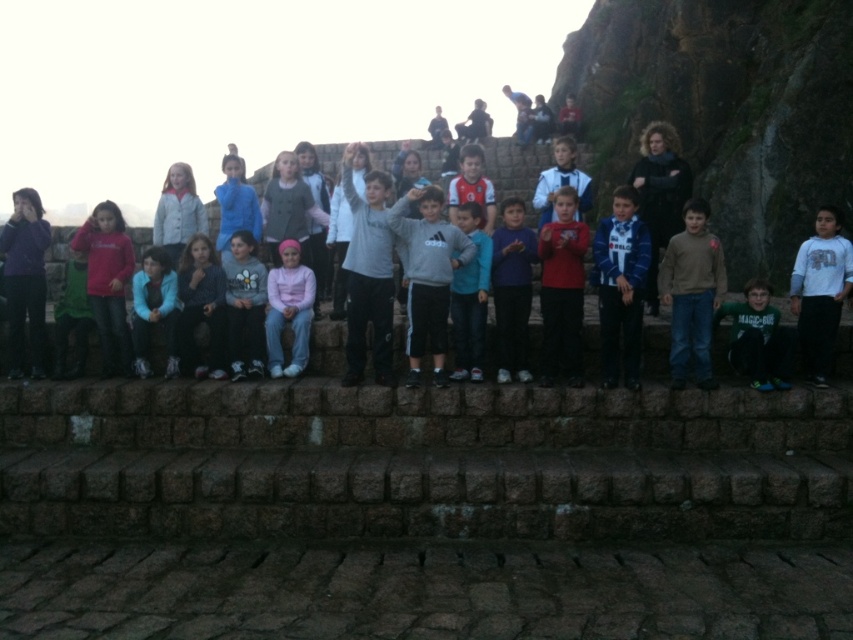
Can you confirm if gray matte sweatshirt at center is positioned to the left of blue striped sweater at center?

Correct, you'll find gray matte sweatshirt at center to the left of blue striped sweater at center.

Does point (457, 259) come behind point (596, 228)?

No, (457, 259) is in front of (596, 228).

You are a GUI agent. You are given a task and a screenshot of the screen. Output one action in this format:
    pyautogui.click(x=<x>, y=<y>)
    Task: Click on the gray matte sweatshirt at center
    The image size is (853, 640).
    Given the screenshot: What is the action you would take?
    pyautogui.click(x=428, y=275)

Who is positioned more to the right, red matte shirt at center or matte blue jacket at lower left?

red matte shirt at center is more to the right.

Is red matte shirt at center bigger than matte blue jacket at lower left?

Yes.

Describe the element at coordinates (561, 289) in the screenshot. I see `red matte shirt at center` at that location.

Find the location of a particular element. The height and width of the screenshot is (640, 853). red matte shirt at center is located at coordinates (561, 289).

Does brown rock cliff at right have a larger size compared to gray sweater at center?

Yes.

Is brown rock cliff at right below gray sweater at center?

Incorrect, brown rock cliff at right is not positioned below gray sweater at center.

Between point (676, 10) and point (257, 273), which one is positioned in front?

Point (257, 273)

This screenshot has width=853, height=640. Identify the location of brown rock cliff at right. (724, 108).